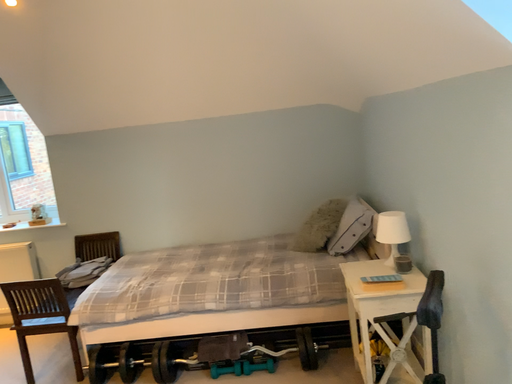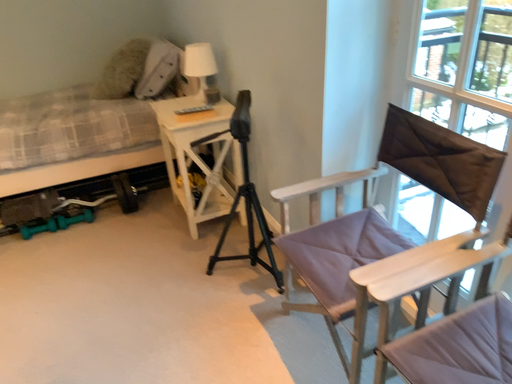
Question: How did the camera likely rotate when shooting the video?

Choices:
 (A) rotated downward
 (B) rotated upward

Answer: (A)